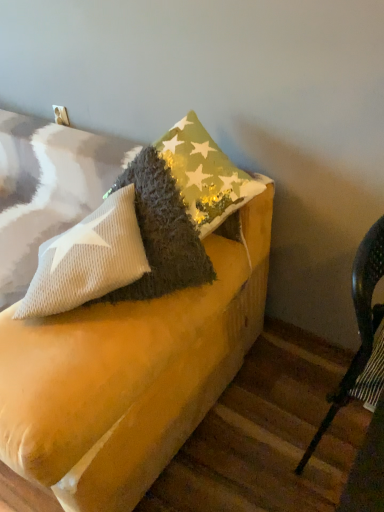
What do you see at coordinates (130, 375) in the screenshot? I see `velvet yellow couch at center` at bounding box center [130, 375].

Find the location of a particular element. velvet yellow couch at center is located at coordinates (130, 375).

The height and width of the screenshot is (512, 384). What do you see at coordinates (359, 329) in the screenshot?
I see `metallic dark green chair at right` at bounding box center [359, 329].

At what (x,y) coordinates should I click in order to perform the action: click on metallic dark green chair at right. Please return your answer as a coordinate pair (x, y). Looking at the image, I should click on (359, 329).

Locate an element on the screen. This screenshot has width=384, height=512. velvet yellow couch at center is located at coordinates click(x=130, y=375).

Is velvet yellow couch at center at the left side of metallic dark green chair at right?

Indeed, velvet yellow couch at center is positioned on the left side of metallic dark green chair at right.

Which object is closer to the camera, velvet yellow couch at center or metallic dark green chair at right?

metallic dark green chair at right is in front.

Between point (45, 414) and point (360, 311), which one is positioned in front?

The point (45, 414) is more forward.

From the image's perspective, is velvet yellow couch at center located above metallic dark green chair at right?

Correct, velvet yellow couch at center appears higher than metallic dark green chair at right in the image.

From a real-world perspective, is velvet yellow couch at center physically located above or below metallic dark green chair at right?

velvet yellow couch at center is above metallic dark green chair at right.

Is velvet yellow couch at center thinner than metallic dark green chair at right?

No, velvet yellow couch at center is not thinner than metallic dark green chair at right.

In terms of height, does velvet yellow couch at center look taller or shorter compared to metallic dark green chair at right?

Considering their sizes, velvet yellow couch at center has less height than metallic dark green chair at right.

Which of these two, velvet yellow couch at center or metallic dark green chair at right, is smaller?

metallic dark green chair at right is smaller.

Is velvet yellow couch at center not inside metallic dark green chair at right?

Absolutely, velvet yellow couch at center is external to metallic dark green chair at right.

Is velvet yellow couch at center far from metallic dark green chair at right?

velvet yellow couch at center is actually quite close to metallic dark green chair at right.

Could you tell me if velvet yellow couch at center is facing metallic dark green chair at right?

No, velvet yellow couch at center is not turned towards metallic dark green chair at right.

What's the angular difference between velvet yellow couch at center and metallic dark green chair at right's facing directions?

The facing directions of velvet yellow couch at center and metallic dark green chair at right are 107 degrees apart.

Locate an element on the screen. chair lying on the right of velvet yellow couch at center is located at coordinates (359, 329).

Between metallic dark green chair at right and velvet yellow couch at center, which one appears on the left side from the viewer's perspective?

Positioned to the left is velvet yellow couch at center.

Is the position of metallic dark green chair at right less distant than that of velvet yellow couch at center?

That is True.

Is point (305, 451) closer or farther from the camera than point (47, 415)?

Clearly, point (305, 451) is more distant from the camera than point (47, 415).

From the image's perspective, would you say metallic dark green chair at right is shown under velvet yellow couch at center?

Yes, from the image's perspective, metallic dark green chair at right is beneath velvet yellow couch at center.

From a real-world perspective, who is located higher, metallic dark green chair at right or velvet yellow couch at center?

velvet yellow couch at center.

Is metallic dark green chair at right wider or thinner than velvet yellow couch at center?

Clearly, metallic dark green chair at right has less width compared to velvet yellow couch at center.

Is metallic dark green chair at right taller or shorter than velvet yellow couch at center?

In the image, metallic dark green chair at right appears to be taller than velvet yellow couch at center.

Which of these two, metallic dark green chair at right or velvet yellow couch at center, is smaller?

Smaller between the two is metallic dark green chair at right.

Is velvet yellow couch at center a part of metallic dark green chair at right?

No, velvet yellow couch at center is located outside of metallic dark green chair at right.

Can you see metallic dark green chair at right touching velvet yellow couch at center?

They are not placed beside each other.

Is metallic dark green chair at right aimed at velvet yellow couch at center?

No, metallic dark green chair at right is not turned towards velvet yellow couch at center.

Where is `furniture above the metallic dark green chair at right (from the image's perspective)`? furniture above the metallic dark green chair at right (from the image's perspective) is located at coordinates (130, 375).

This screenshot has height=512, width=384. I want to click on chair below the velvet yellow couch at center (from the image's perspective), so click(x=359, y=329).

Identify the location of furniture behind the metallic dark green chair at right. The width and height of the screenshot is (384, 512). (130, 375).